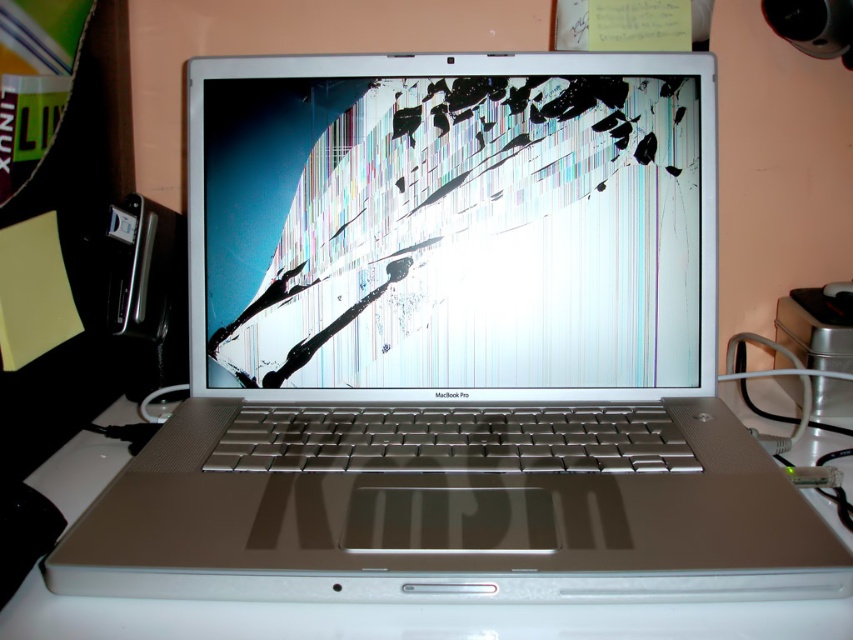
Question: Which object is farther from the camera taking this photo?

Choices:
 (A) cracked glass screen at center
 (B) white matte table at center

Answer: (A)

Question: Which point is farther to the camera?

Choices:
 (A) cracked glass screen at center
 (B) white matte table at center

Answer: (A)

Question: Is cracked glass screen at center above white matte table at center?

Choices:
 (A) no
 (B) yes

Answer: (B)

Question: Which of the following is the farthest from the observer?

Choices:
 (A) cracked glass screen at center
 (B) white matte table at center

Answer: (A)

Question: Can you confirm if cracked glass screen at center is smaller than white matte table at center?

Choices:
 (A) no
 (B) yes

Answer: (B)

Question: Does cracked glass screen at center appear under white matte table at center?

Choices:
 (A) yes
 (B) no

Answer: (B)